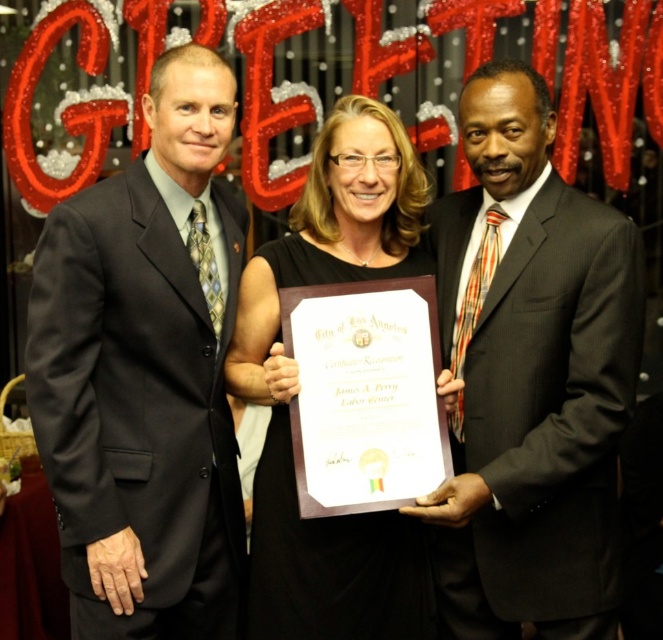
Question: Which point is farther to the camera?

Choices:
 (A) matte black suit at center
 (B) black satin dress at center

Answer: (B)

Question: Observing the image, what is the correct spatial positioning of matte black suit at left in reference to matte black suit at center?

Choices:
 (A) right
 (B) left

Answer: (B)

Question: Which object is positioned farthest from the black satin dress at center?

Choices:
 (A) matte black suit at center
 (B) matte black suit at left

Answer: (A)

Question: Is matte black suit at left positioned behind black satin dress at center?

Choices:
 (A) no
 (B) yes

Answer: (A)

Question: Can you confirm if matte black suit at center is positioned to the right of black satin dress at center?

Choices:
 (A) yes
 (B) no

Answer: (A)

Question: Which object is farther from the camera taking this photo?

Choices:
 (A) black satin dress at center
 (B) matte black suit at left

Answer: (A)